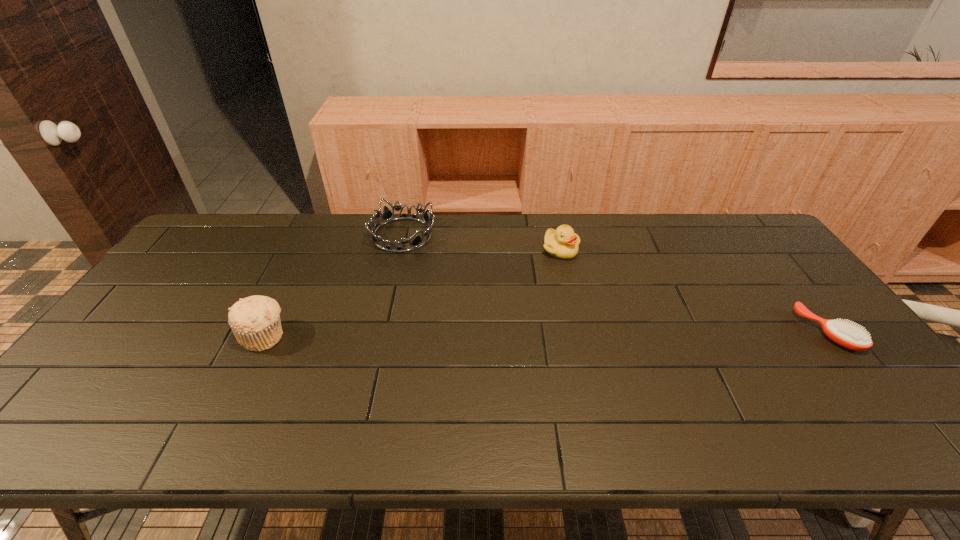
You are a GUI agent. You are given a task and a screenshot of the screen. Output one action in this format:
    pyautogui.click(x=<x>, y=<y>)
    Task: Click on the leftmost object
    
    Given the screenshot: What is the action you would take?
    pyautogui.click(x=255, y=321)

The height and width of the screenshot is (540, 960). Identify the location of the tallest object. (255, 321).

This screenshot has height=540, width=960. Identify the location of the shortest object. (845, 334).

Where is `hairbrush`? This screenshot has height=540, width=960. hairbrush is located at coordinates (845, 334).

The height and width of the screenshot is (540, 960). Identify the location of the second object from left to right. (387, 216).

Where is `duckling`? duckling is located at coordinates (562, 243).

Where is `free space located on the right of the tallest object`? The height and width of the screenshot is (540, 960). free space located on the right of the tallest object is located at coordinates (333, 336).

The image size is (960, 540). Identify the location of vacant space situated on the left of the hairbrush. (664, 332).

I want to click on vacant space situated on the front-facing side of the tiara, so click(428, 259).

Image resolution: width=960 pixels, height=540 pixels. Find the location of `free location located 0.120m on the front-facing side of the tiara`. free location located 0.120m on the front-facing side of the tiara is located at coordinates (440, 270).